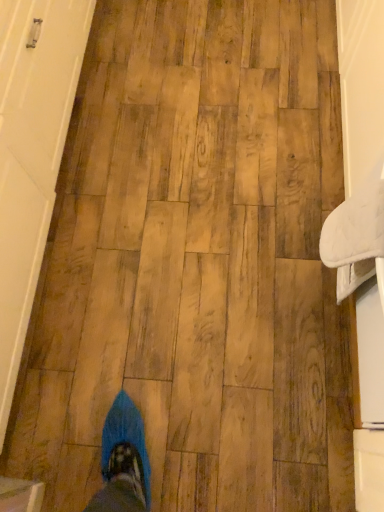
Describe the element at coordinates (31, 153) in the screenshot. I see `transparent plastic screen door at left` at that location.

You are a GUI agent. You are given a task and a screenshot of the screen. Output one action in this format:
    pyautogui.click(x=<x>, y=<y>)
    Task: Click on the transparent plastic screen door at left
    Image resolution: width=384 pixels, height=512 pixels.
    Given the screenshot: What is the action you would take?
    pyautogui.click(x=31, y=153)

From the picture: Measure the distance between transparent plastic screen door at left and camera.

The distance of transparent plastic screen door at left from camera is 3.47 feet.

Locate an element on the screen. transparent plastic screen door at left is located at coordinates (31, 153).